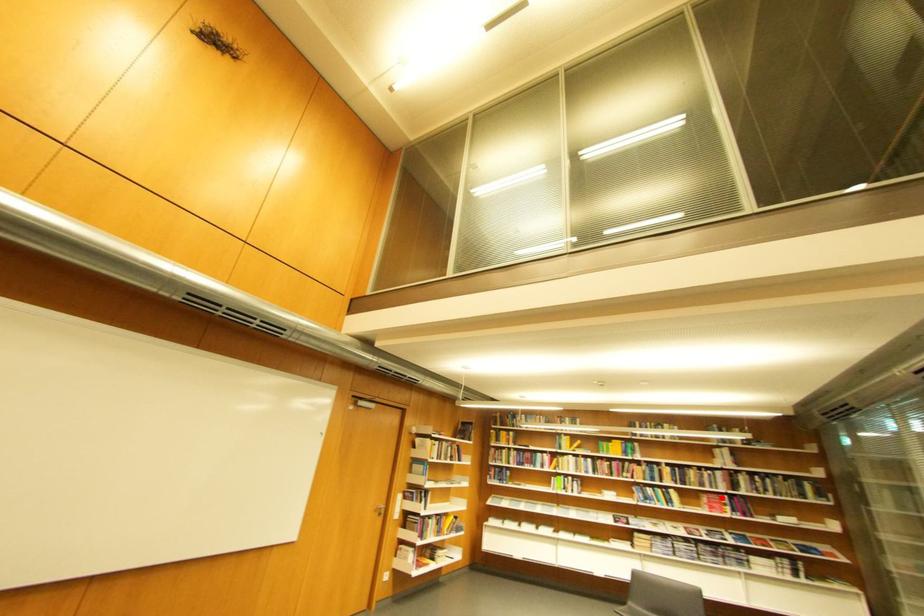
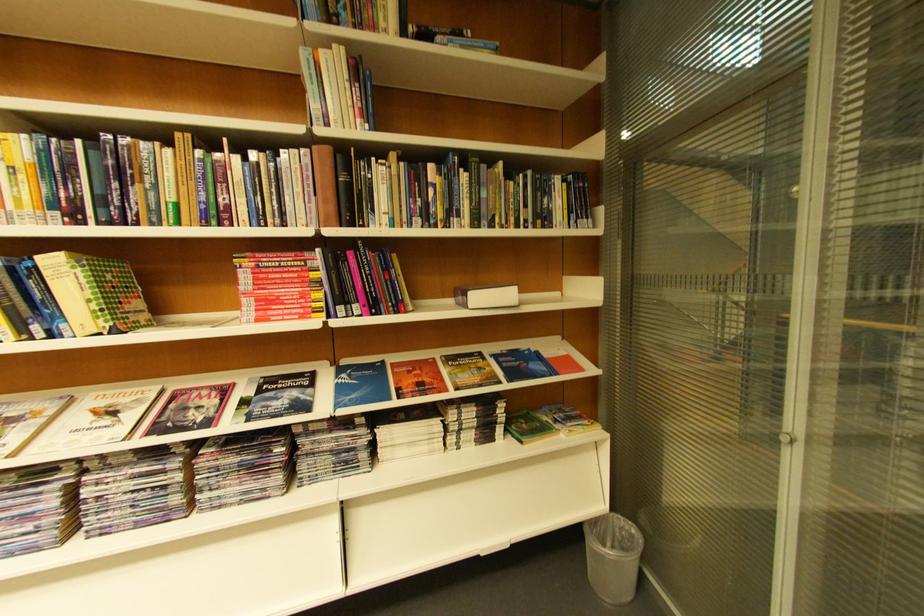
The point at the highlighted location is marked in the first image. Where is the corresponding point in the second image?

(281, 262)